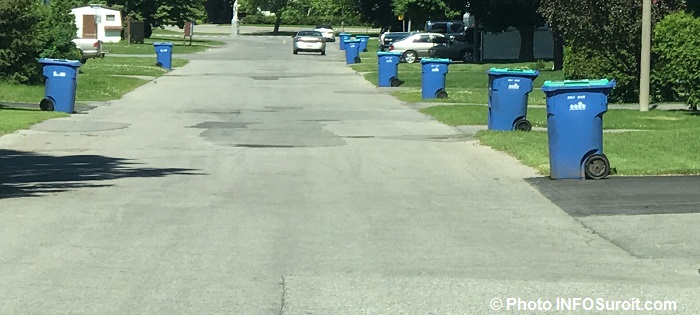
Image resolution: width=700 pixels, height=315 pixels. Identify the location of garbage bins. (579, 127), (508, 97), (434, 80), (386, 66), (354, 49), (363, 40), (344, 34), (162, 49), (63, 78).